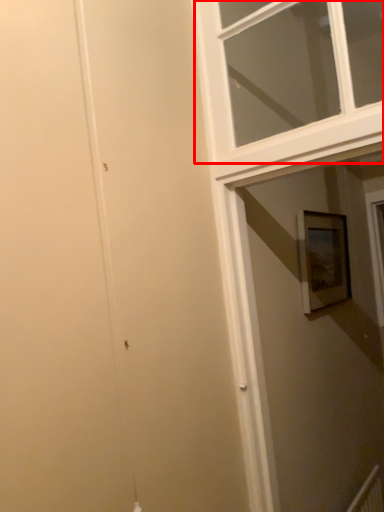
Question: From the image's perspective, considering the relative positions of window (annotated by the red box) and picture frame in the image provided, where is window (annotated by the red box) located with respect to the staircase?

Choices:
 (A) below
 (B) above

Answer: (B)